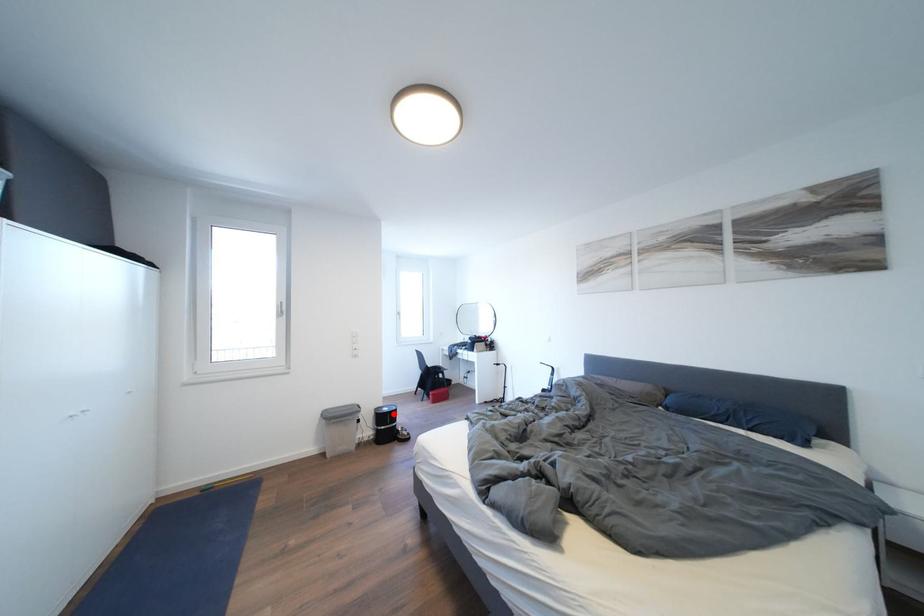
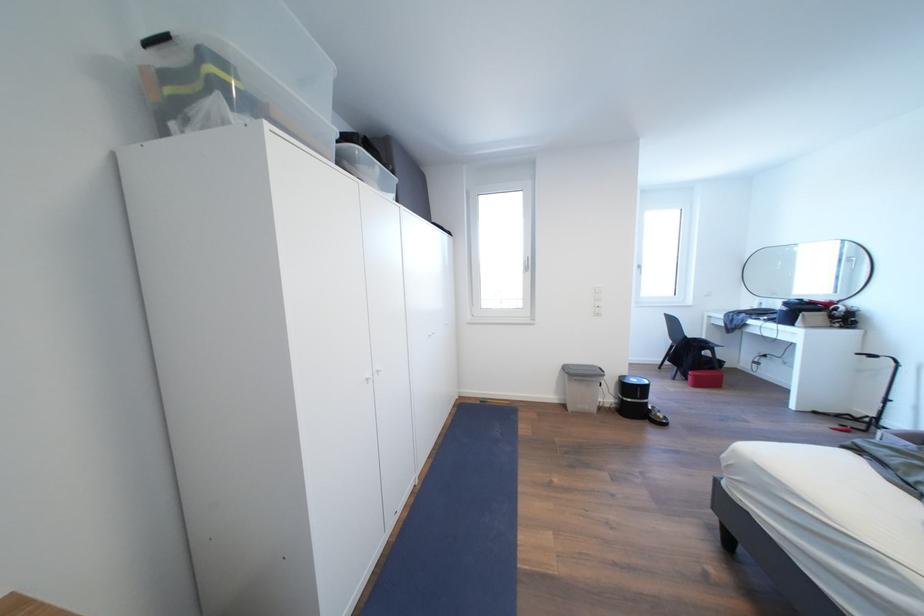
Question: I am providing you with two images of the same scene from different viewpoints. Image1 has a red point marked. In image2, the corresponding 3D location appears at what relative position? Reply with the corresponding letter.

Choices:
 (A) Closer
 (B) Farther

Answer: (B)